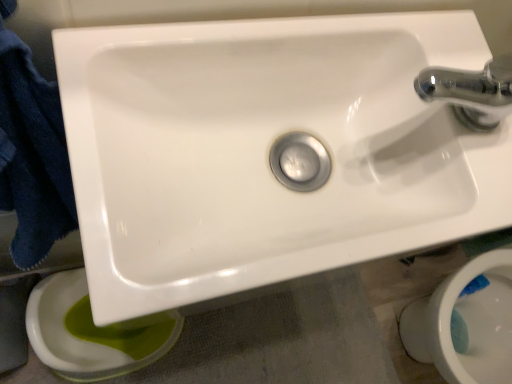
Question: From the image's perspective, is white glossy sink at center beneath green glossy toilet bowl at lower left, the 1th toilet bowl viewed from the left?

Choices:
 (A) yes
 (B) no

Answer: (B)

Question: Does white glossy sink at center have a larger size compared to green glossy toilet bowl at lower left, arranged as the second toilet bowl when viewed from the right?

Choices:
 (A) no
 (B) yes

Answer: (A)

Question: From a real-world perspective, is white glossy sink at center on top of green glossy toilet bowl at lower left, arranged as the second toilet bowl when viewed from the right?

Choices:
 (A) no
 (B) yes

Answer: (B)

Question: Is white glossy sink at center shorter than green glossy toilet bowl at lower left, the 1th toilet bowl viewed from the left?

Choices:
 (A) no
 (B) yes

Answer: (B)

Question: Does white glossy sink at center appear on the left side of green glossy toilet bowl at lower left, the 1th toilet bowl viewed from the left?

Choices:
 (A) no
 (B) yes

Answer: (A)

Question: Considering the relative sizes of white glossy sink at center and green glossy toilet bowl at lower left, arranged as the second toilet bowl when viewed from the right, in the image provided, is white glossy sink at center wider than green glossy toilet bowl at lower left, arranged as the second toilet bowl when viewed from the right,?

Choices:
 (A) yes
 (B) no

Answer: (B)

Question: Is the depth of white glossy toilet bowl at lower right, the second toilet bowl positioned from the left, greater than that of white glossy sink at center?

Choices:
 (A) no
 (B) yes

Answer: (B)

Question: Does white glossy toilet bowl at lower right, the second toilet bowl positioned from the left, have a lesser width compared to white glossy sink at center?

Choices:
 (A) yes
 (B) no

Answer: (B)

Question: Does white glossy toilet bowl at lower right, which is the first toilet bowl from right to left, have a greater width compared to white glossy sink at center?

Choices:
 (A) no
 (B) yes

Answer: (B)

Question: Can you confirm if white glossy toilet bowl at lower right, the second toilet bowl positioned from the left, is positioned to the left of white glossy sink at center?

Choices:
 (A) yes
 (B) no

Answer: (B)

Question: Can you confirm if white glossy toilet bowl at lower right, which is the first toilet bowl from right to left, is positioned to the right of white glossy sink at center?

Choices:
 (A) no
 (B) yes

Answer: (B)

Question: Is dark blue towel at left bigger than white glossy toilet bowl at lower right, the second toilet bowl positioned from the left?

Choices:
 (A) no
 (B) yes

Answer: (A)